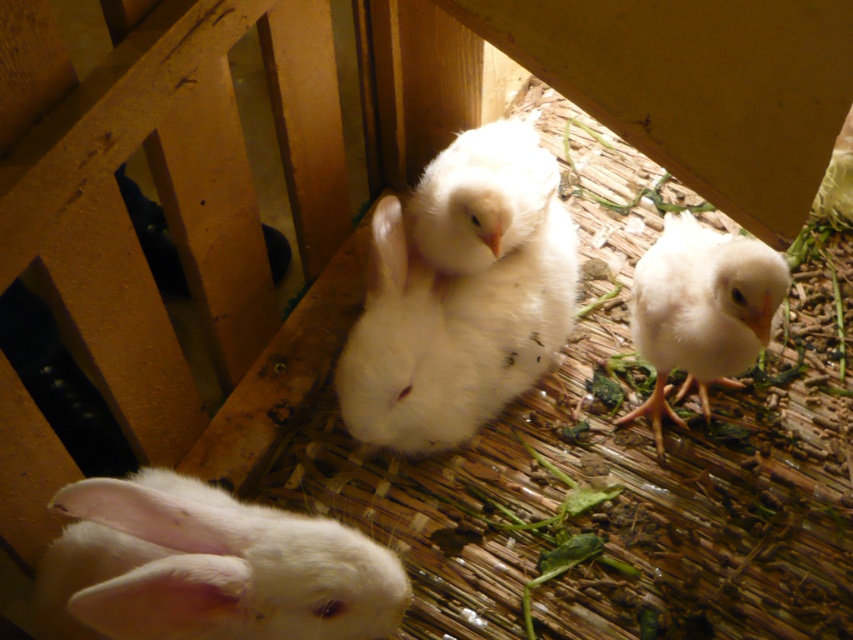
You are standing in the wooden enclosure and want to place a small treat for the white fluffy rabbit at lower left. According to the coordinates provided, where should you aim to place the treat?

The white fluffy rabbit at lower left is located at coordinates point (207, 566), so you should aim to place the treat near that position.

You are a photographer trying to capture a clear shot of both the white fluffy rabbit at center and the white fluffy rabbit at lower right. Based on their positions, which rabbit will appear closer to the camera in the photo?

The white fluffy rabbit at center will appear closer to the camera because the white fluffy rabbit at lower right is positioned behind it.